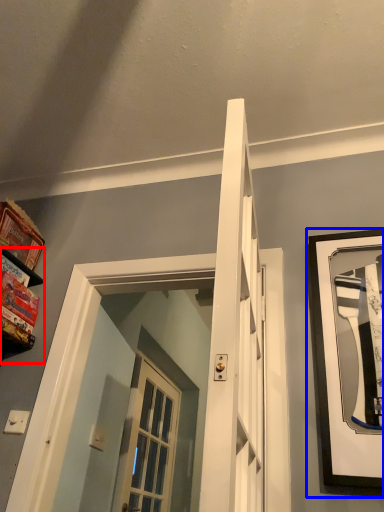
Question: Among these objects, which one is nearest to the camera, shelf (highlighted by a red box) or picture frame (highlighted by a blue box)?

Choices:
 (A) shelf
 (B) picture frame

Answer: (B)